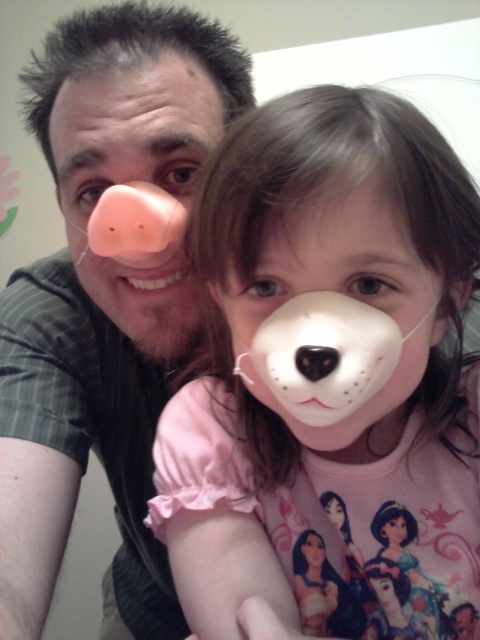
Question: Which object appears closest to the camera in this image?

Choices:
 (A) white matte dog nose mask at center
 (B) white matte bear mask at center
 (C) smooth pink bear mask at center

Answer: (A)

Question: Does white matte dog nose mask at center appear over white rubber dog nose at upper center?

Choices:
 (A) no
 (B) yes

Answer: (A)

Question: Does matte pink nose at upper left appear under smooth pink bear mask at center?

Choices:
 (A) yes
 (B) no

Answer: (B)

Question: Is matte pink nose at upper left wider than white matte bear mask at center?

Choices:
 (A) no
 (B) yes

Answer: (B)

Question: Which of these objects is positioned farthest from the smooth pink bear mask at center?

Choices:
 (A) white rubber dog nose at upper center
 (B) white matte bear mask at center
 (C) white matte dog nose mask at center
 (D) matte pink nose at left

Answer: (D)

Question: Which point is closer to the camera?

Choices:
 (A) smooth pink bear mask at center
 (B) matte pink nose at upper left
 (C) white matte bear mask at center
 (D) white matte dog nose mask at center

Answer: (D)